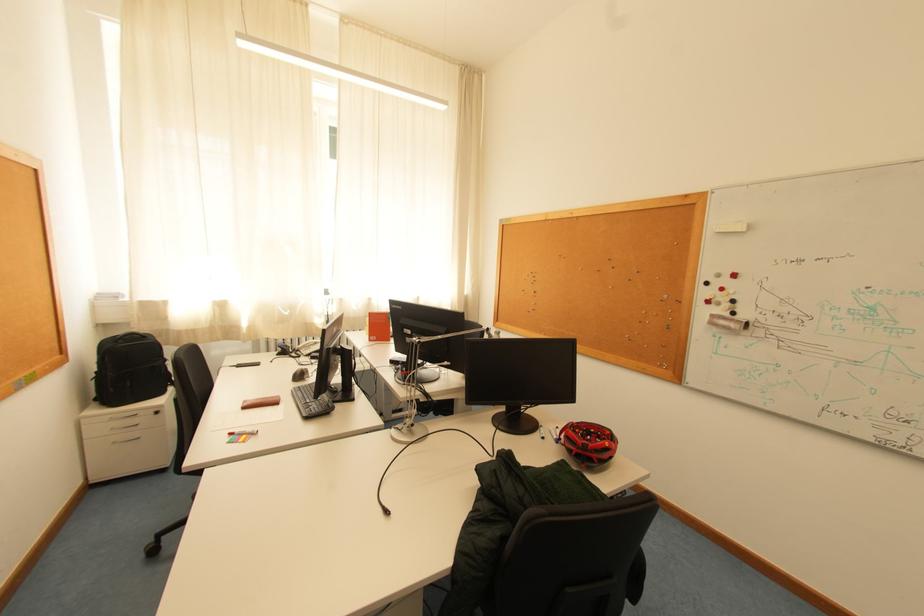
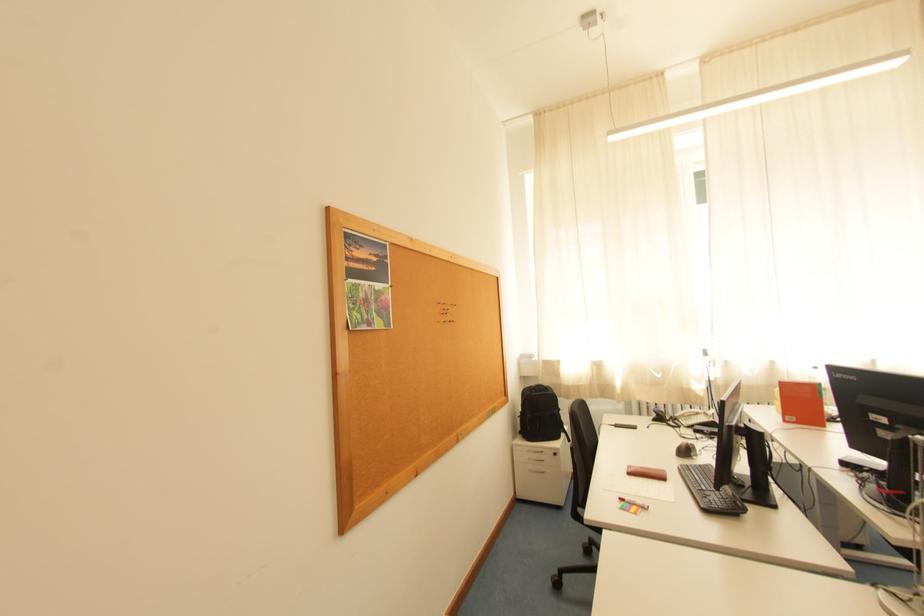
In the second image, find the point that corresponds to pixel 320 347 in the first image.

(699, 418)